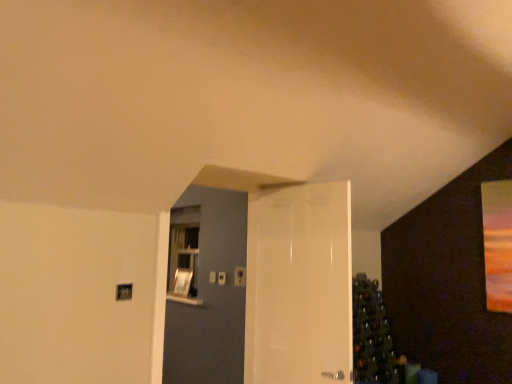
This screenshot has height=384, width=512. In order to click on white glossy door at center in this screenshot , I will do `click(298, 285)`.

This screenshot has width=512, height=384. What do you see at coordinates (298, 285) in the screenshot?
I see `white glossy door at center` at bounding box center [298, 285].

Find the location of a particular element. The width and height of the screenshot is (512, 384). white glossy door at center is located at coordinates (298, 285).